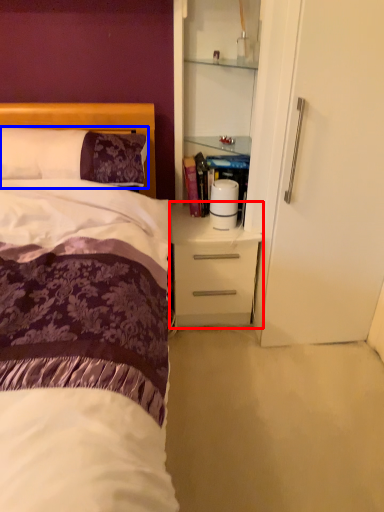
Question: Which object appears farthest to the camera in this image, desk (highlighted by a red box) or pillow (highlighted by a blue box)?

Choices:
 (A) desk
 (B) pillow

Answer: (A)